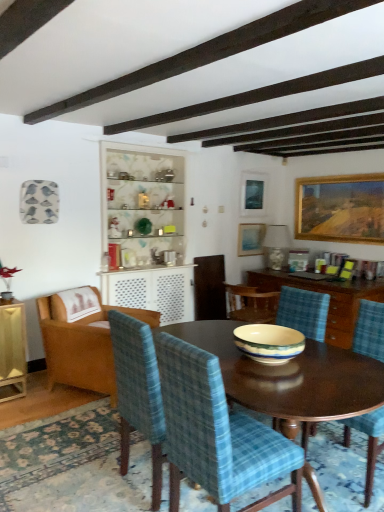
Question: Should I look upward or downward to see wooden table at center?

Choices:
 (A) down
 (B) up

Answer: (A)

Question: Which direction should I rotate to face matte blue picture frame at upper center, which ranks as the first picture frame in left-to-right order, — up or down?

Choices:
 (A) down
 (B) up

Answer: (B)

Question: Does white glossy cabinet at center have a greater height compared to wooden armchair at left, positioned as the fourth chair in right-to-left order?

Choices:
 (A) no
 (B) yes

Answer: (B)

Question: Does white glossy cabinet at center have a lesser height compared to wooden armchair at left, positioned as the fourth chair in right-to-left order?

Choices:
 (A) yes
 (B) no

Answer: (B)

Question: Is white glossy cabinet at center completely or partially outside of wooden armchair at left, the first chair viewed from the left?

Choices:
 (A) no
 (B) yes

Answer: (B)

Question: Is white glossy cabinet at center next to wooden armchair at left, the first chair viewed from the left, and touching it?

Choices:
 (A) yes
 (B) no

Answer: (B)

Question: Is white glossy cabinet at center far from wooden armchair at left, the first chair viewed from the left?

Choices:
 (A) yes
 (B) no

Answer: (B)

Question: Does white glossy cabinet at center contain wooden armchair at left, the first chair viewed from the left?

Choices:
 (A) yes
 (B) no

Answer: (B)

Question: Is wooden cabinet at center wider than matte glass picture frame at upper center, arranged as the 2th picture frame when viewed from the right?

Choices:
 (A) yes
 (B) no

Answer: (A)

Question: Does wooden cabinet at center have a smaller size compared to matte glass picture frame at upper center, placed as the second picture frame when sorted from left to right?

Choices:
 (A) yes
 (B) no

Answer: (B)

Question: Is wooden cabinet at center outside of matte glass picture frame at upper center, arranged as the 2th picture frame when viewed from the right?

Choices:
 (A) yes
 (B) no

Answer: (A)

Question: Considering the relative positions of wooden cabinet at center and matte glass picture frame at upper center, arranged as the 2th picture frame when viewed from the right, in the image provided, is wooden cabinet at center behind matte glass picture frame at upper center, arranged as the 2th picture frame when viewed from the right,?

Choices:
 (A) yes
 (B) no

Answer: (B)

Question: Does wooden cabinet at center turn towards matte glass picture frame at upper center, placed as the second picture frame when sorted from left to right?

Choices:
 (A) yes
 (B) no

Answer: (B)

Question: From the image's perspective, is wooden cabinet at center on matte glass picture frame at upper center, placed as the second picture frame when sorted from left to right?

Choices:
 (A) no
 (B) yes

Answer: (A)

Question: From the image's perspective, is white glossy cabinet at center over matte glass picture frame at upper center, arranged as the 2th picture frame when viewed from the right?

Choices:
 (A) no
 (B) yes

Answer: (A)